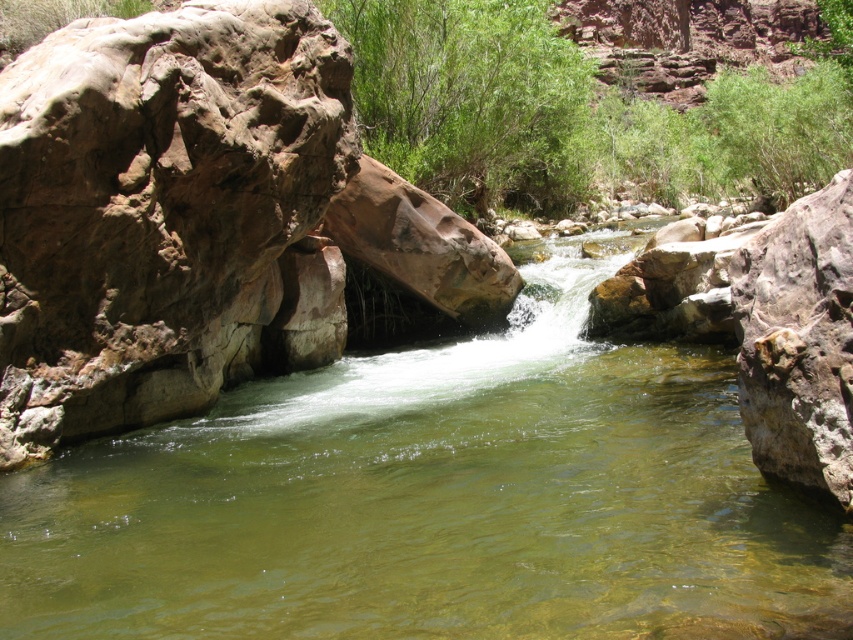
Question: Is clear water stream at center smaller than green leafy shrubs at center?

Choices:
 (A) yes
 (B) no

Answer: (A)

Question: Can you confirm if clear water stream at center is positioned above green leafy shrubs at center?

Choices:
 (A) yes
 (B) no

Answer: (B)

Question: Which object appears farthest from the camera in this image?

Choices:
 (A) green leafy shrubs at center
 (B) clear water stream at center
 (C) brown rough rock at left

Answer: (A)

Question: Is clear water stream at center positioned behind green leafy shrubs at center?

Choices:
 (A) no
 (B) yes

Answer: (A)

Question: Which of these objects is positioned farthest from the green leafy shrubs at center?

Choices:
 (A) clear water stream at center
 (B) brown rough rock at left

Answer: (A)

Question: Which of the following is the closest to the observer?

Choices:
 (A) clear water stream at center
 (B) brown rough rock at left
 (C) green leafy shrubs at center

Answer: (A)